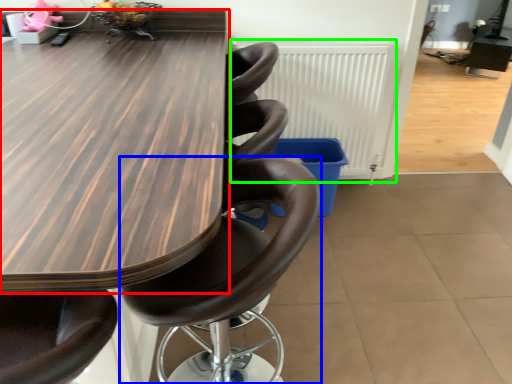
Question: Considering the real-world distances, which object is farthest from table (highlighted by a red box)? chair (highlighted by a blue box) or radiator (highlighted by a green box)?

Choices:
 (A) chair
 (B) radiator

Answer: (B)